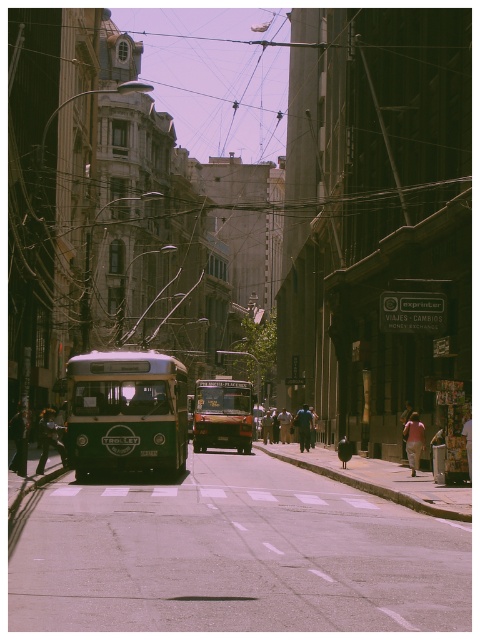
You are a pedestrian standing on the sidewalk and want to cross the street to reach the building with the rounded window on the left. Which object, the green matte trolley at center or the metallic brown bus at center, is closer to the building with the rounded window?

The metallic brown bus at center is closer to the building with the rounded window because the green matte trolley at center is located above it, meaning the bus is positioned lower and nearer to the building.

You are standing at the intersection and see a point marked at coordinates (x=126, y=412). What object is located at that point?

The point at (x=126, y=412) indicates the green matte trolley at center.

You are standing at the middle of the road in this urban scene. You see two points marked on the image. The first point is at coordinate point (145, 408) and the second point is at coordinate point (207, 442). Which point is closer to you?

Point (145, 408) is closer to the camera than point (207, 442).